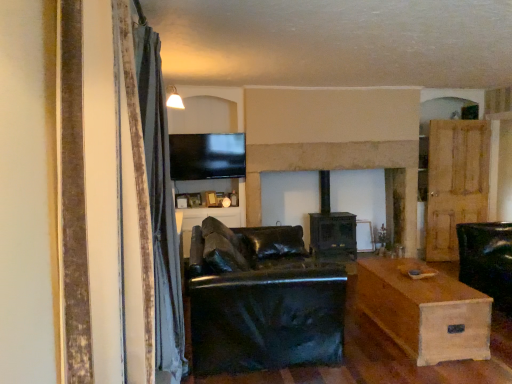
Question: Can you confirm if stone fireplace at center is smaller than flat screen tv at upper center?

Choices:
 (A) no
 (B) yes

Answer: (A)

Question: Is stone fireplace at center bigger than flat screen tv at upper center?

Choices:
 (A) no
 (B) yes

Answer: (B)

Question: Can you confirm if stone fireplace at center is shorter than flat screen tv at upper center?

Choices:
 (A) no
 (B) yes

Answer: (A)

Question: Is stone fireplace at center beside flat screen tv at upper center?

Choices:
 (A) no
 (B) yes

Answer: (A)

Question: From the image's perspective, is stone fireplace at center above flat screen tv at upper center?

Choices:
 (A) yes
 (B) no

Answer: (B)

Question: Is wooden door at right to the left or to the right of light brown wooden table at lower right in the image?

Choices:
 (A) right
 (B) left

Answer: (A)

Question: Considering the positions of wooden door at right and light brown wooden table at lower right in the image, is wooden door at right taller or shorter than light brown wooden table at lower right?

Choices:
 (A) short
 (B) tall

Answer: (B)

Question: In terms of size, does wooden door at right appear bigger or smaller than light brown wooden table at lower right?

Choices:
 (A) small
 (B) big

Answer: (A)

Question: Is wooden door at right inside or outside of light brown wooden table at lower right?

Choices:
 (A) inside
 (B) outside

Answer: (B)

Question: Considering the positions of flat screen tv at upper center and velvet gray curtain at left in the image, is flat screen tv at upper center taller or shorter than velvet gray curtain at left?

Choices:
 (A) tall
 (B) short

Answer: (B)

Question: Is flat screen tv at upper center inside or outside of velvet gray curtain at left?

Choices:
 (A) inside
 (B) outside

Answer: (B)

Question: Does point (202, 170) appear closer or farther from the camera than point (179, 261)?

Choices:
 (A) farther
 (B) closer

Answer: (A)

Question: Considering their positions, is flat screen tv at upper center located in front of or behind velvet gray curtain at left?

Choices:
 (A) front
 (B) behind

Answer: (B)

Question: Is stone fireplace at center taller or shorter than wooden door at right?

Choices:
 (A) short
 (B) tall

Answer: (B)

Question: Considering the relative positions of stone fireplace at center and wooden door at right in the image provided, is stone fireplace at center to the left or to the right of wooden door at right?

Choices:
 (A) right
 (B) left

Answer: (B)